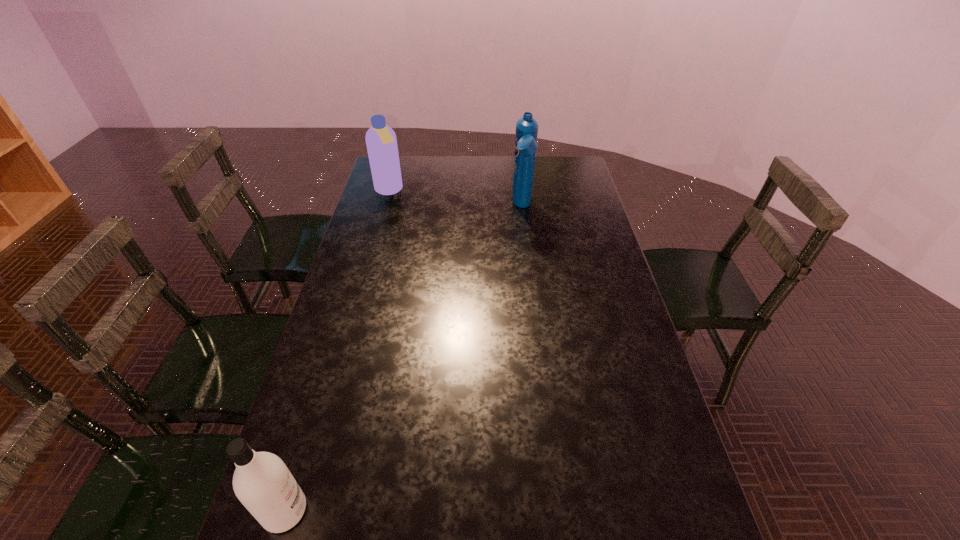
The image size is (960, 540). Identify the location of the rightmost object. (526, 145).

This screenshot has height=540, width=960. Find the location of `the nearest object`. the nearest object is located at coordinates coord(262,482).

Identify the location of vacant space located on the back of the rightmost object. The width and height of the screenshot is (960, 540). 516,161.

Locate an element on the screen. The image size is (960, 540). free space located 0.230m on the front-facing side of the nearest object is located at coordinates (418, 511).

Identify the location of object present at the far edge. The height and width of the screenshot is (540, 960). [381, 142].

Identify the location of object that is at the far left corner. (381, 142).

Where is `free space at the left edge`? This screenshot has height=540, width=960. free space at the left edge is located at coordinates (346, 336).

Image resolution: width=960 pixels, height=540 pixels. In the image, there is a desktop. Identify the location of free space at the right edge. (651, 395).

This screenshot has height=540, width=960. Find the location of `free spot at the far right corner of the desktop`. free spot at the far right corner of the desktop is located at coordinates (581, 170).

Identify the location of free spot between the rightmost shampoo and the nearest object. Image resolution: width=960 pixels, height=540 pixels. (404, 359).